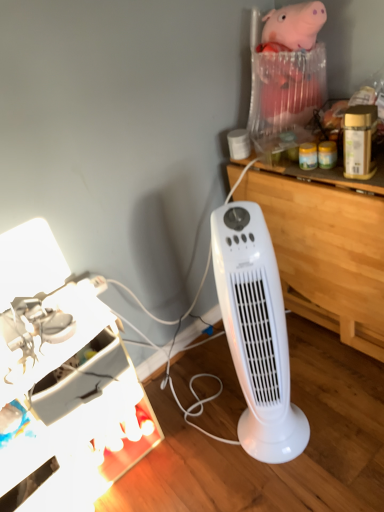
Question: Is wooden at right inside or outside of metallic silver desk lamp at lower left?

Choices:
 (A) inside
 (B) outside

Answer: (B)

Question: From the image's perspective, is wooden at right above or below metallic silver desk lamp at lower left?

Choices:
 (A) below
 (B) above

Answer: (B)

Question: Which of these objects is positioned farthest from the white plastic tower fan at center?

Choices:
 (A) wooden at right
 (B) metallic silver desk lamp at lower left

Answer: (B)

Question: Which is nearer to the wooden at right?

Choices:
 (A) metallic silver desk lamp at lower left
 (B) white plastic tower fan at center

Answer: (B)